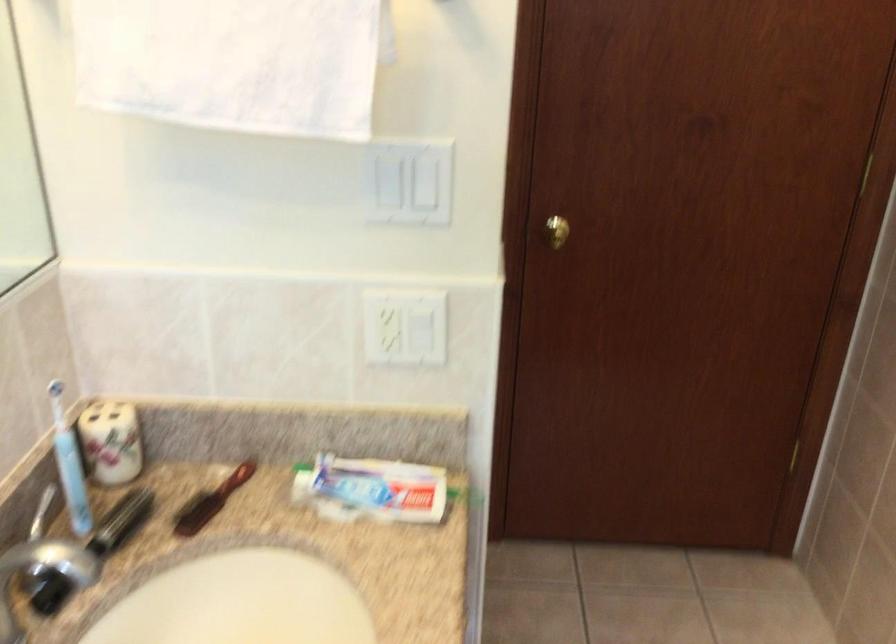
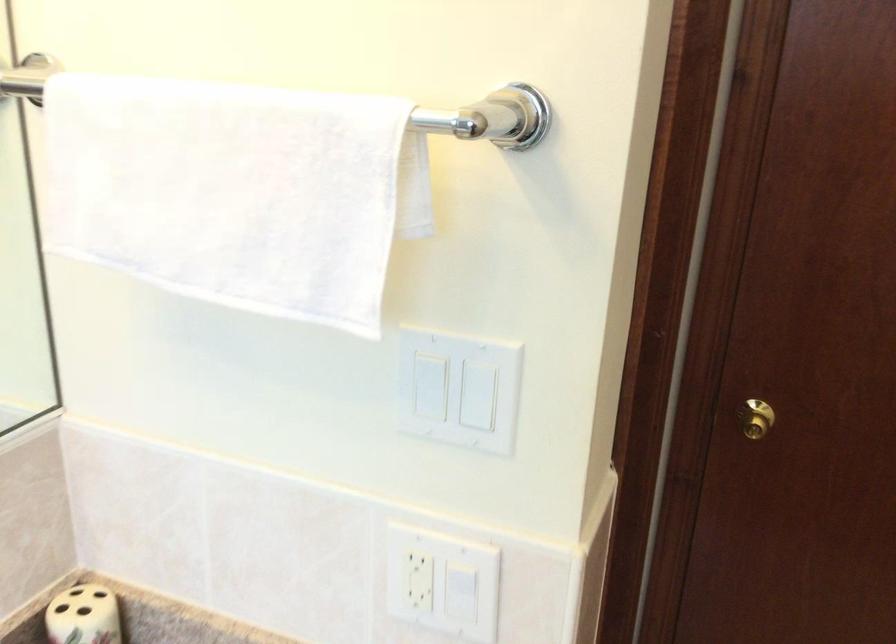
The point at (108, 413) is marked in the first image. Where is the corresponding point in the second image?

(83, 616)